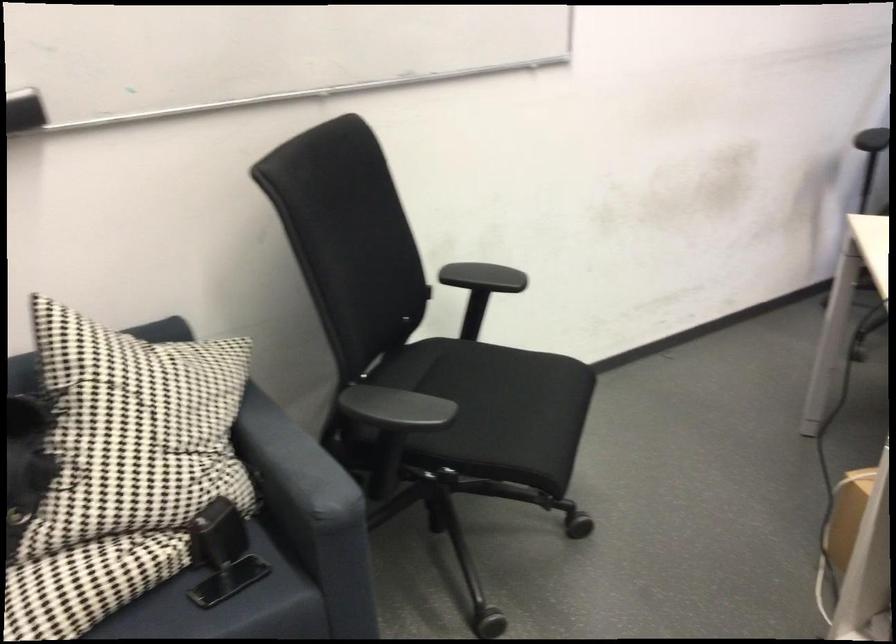
Describe the element at coordinates (293, 464) in the screenshot. The image size is (896, 644). I see `a sofa armrest` at that location.